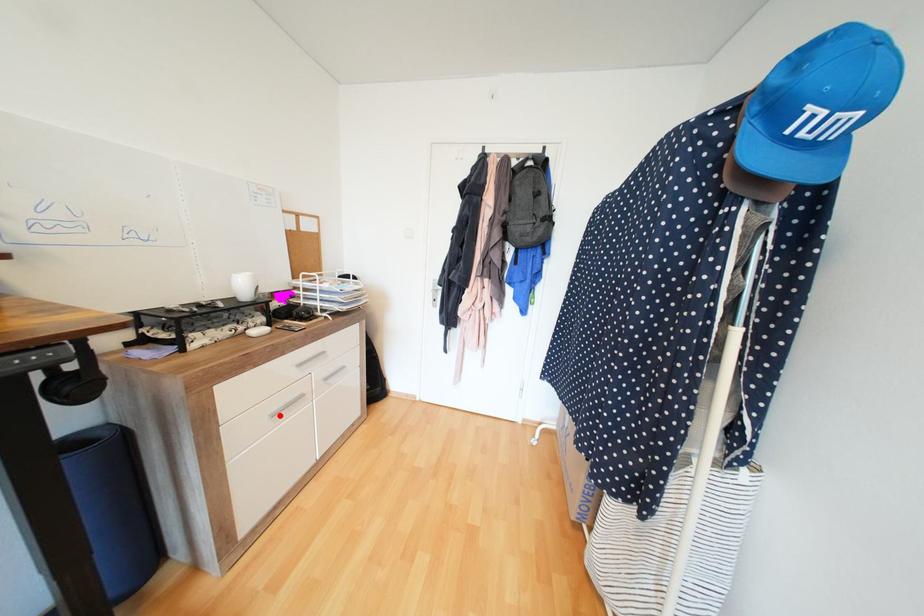
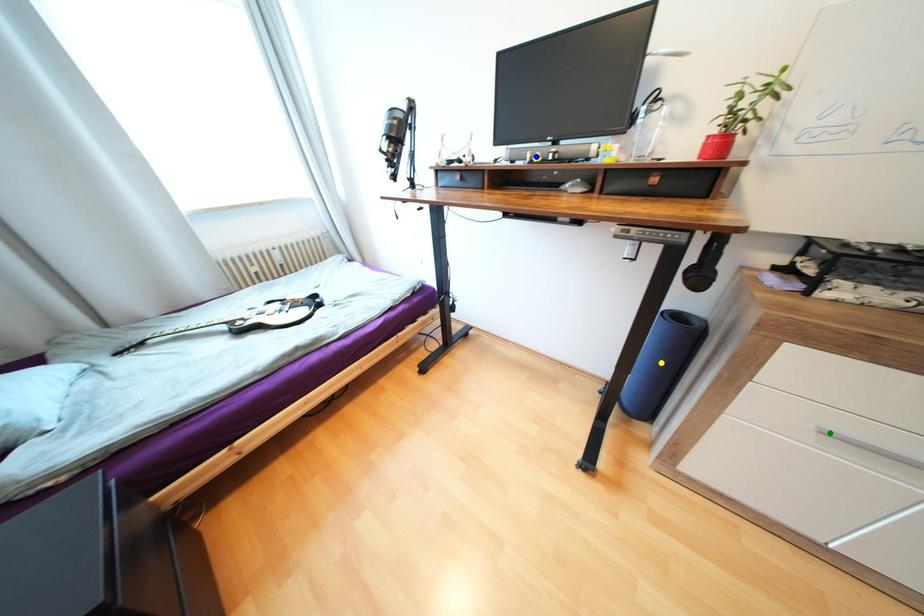
Question: I am providing you with two images of the same scene from different viewpoints. A red point is marked on the first image. You are given multiple points on the second image. Which spot in image 2 lines up with the point in image 1?

Choices:
 (A) yellow point
 (B) blue point
 (C) green point

Answer: (C)